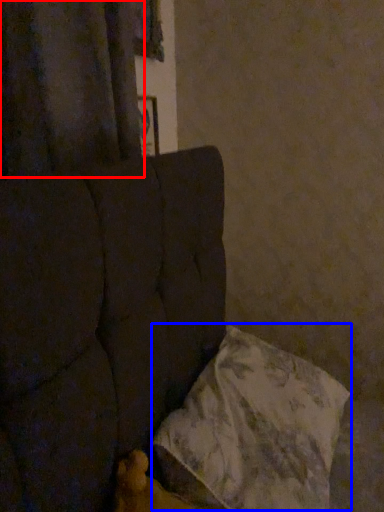
Question: Among these objects, which one is farthest to the camera, curtain (highlighted by a red box) or pillow (highlighted by a blue box)?

Choices:
 (A) curtain
 (B) pillow

Answer: (A)